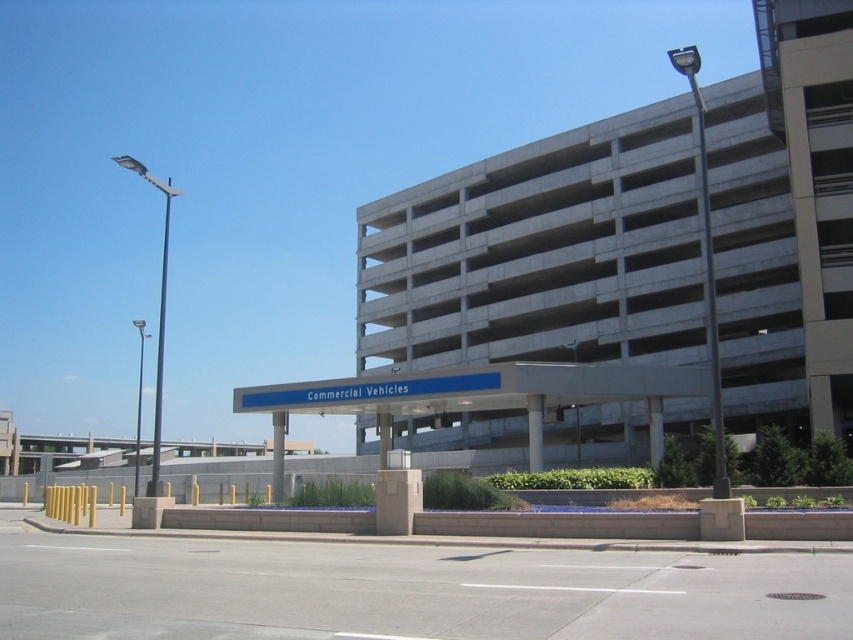
Question: Which of the following is the closest to the observer?

Choices:
 (A) (614, 173)
 (B) (119, 164)

Answer: (A)

Question: Is gray concrete parking garage at upper center to the left of metallic blue sign at upper center from the viewer's perspective?

Choices:
 (A) yes
 (B) no

Answer: (B)

Question: Is gray concrete parking garage at upper center to the left of metallic blue sign at upper center from the viewer's perspective?

Choices:
 (A) yes
 (B) no

Answer: (B)

Question: Among these objects, which one is nearest to the camera?

Choices:
 (A) metallic blue sign at upper center
 (B) gray concrete parking garage at upper center

Answer: (A)

Question: Is gray concrete parking garage at upper center to the right of metallic blue sign at upper center from the viewer's perspective?

Choices:
 (A) yes
 (B) no

Answer: (A)

Question: Which object is closer to the camera taking this photo?

Choices:
 (A) metallic blue sign at upper center
 (B) gray concrete parking garage at upper center

Answer: (A)